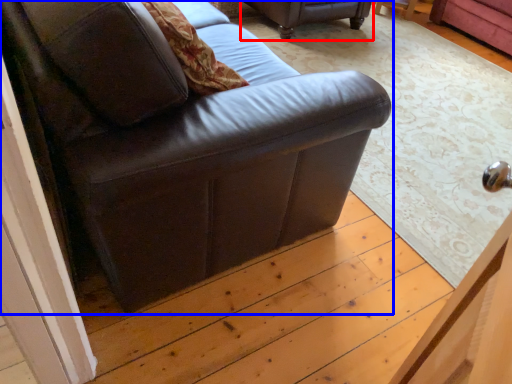
Question: Among these objects, which one is farthest to the camera, studio couch (highlighted by a red box) or studio couch (highlighted by a blue box)?

Choices:
 (A) studio couch
 (B) studio couch

Answer: (A)